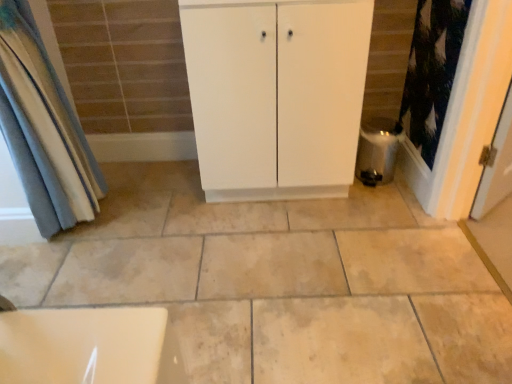
Question: In terms of width, does blue fabric curtain at left look wider or thinner when compared to white matte cabinet at center?

Choices:
 (A) thin
 (B) wide

Answer: (A)

Question: Considering the positions of blue fabric curtain at left and white matte cabinet at center in the image, is blue fabric curtain at left taller or shorter than white matte cabinet at center?

Choices:
 (A) tall
 (B) short

Answer: (A)

Question: Considering the real-world distances, which object is farthest from the satin silver water heater at lower right?

Choices:
 (A) blue fabric curtain at left
 (B) white matte cabinet at center

Answer: (A)

Question: Which of these objects is positioned closest to the white matte cabinet at center?

Choices:
 (A) satin silver water heater at lower right
 (B) blue fabric curtain at left

Answer: (A)